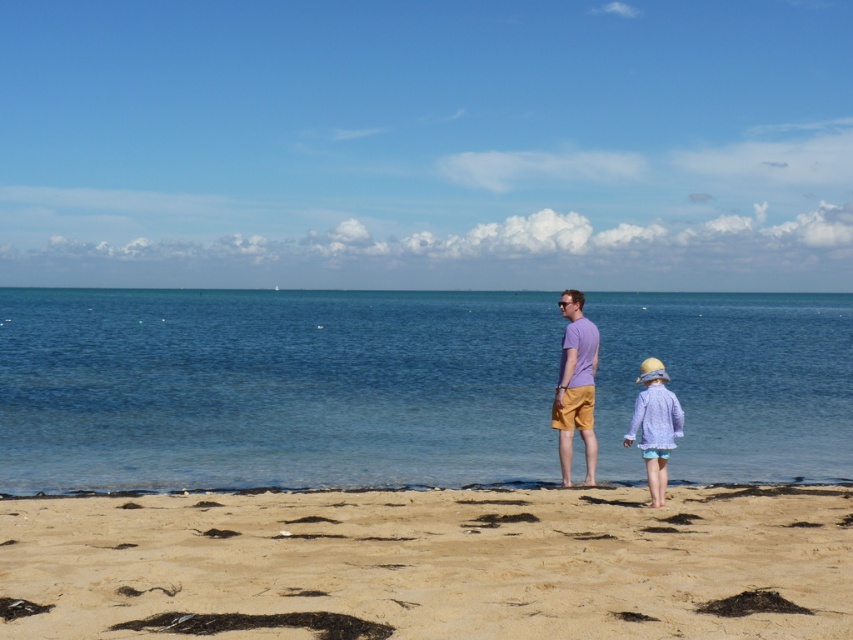
Question: Is light brown sandy beach at lower center above purple cotton shirt at center?

Choices:
 (A) no
 (B) yes

Answer: (A)

Question: Which point is closer to the camera?

Choices:
 (A) purple cotton shirt at center
 (B) light brown sandy beach at lower center
 (C) light purple cotton dress at lower right

Answer: (B)

Question: Observing the image, what is the correct spatial positioning of purple cotton shirt at center in reference to light purple cotton dress at lower right?

Choices:
 (A) below
 (B) above

Answer: (B)

Question: Estimate the real-world distances between objects in this image. Which object is farther from the light purple cotton dress at lower right?

Choices:
 (A) light brown sandy beach at lower center
 (B) clear blue water at center

Answer: (B)

Question: Based on their relative distances, which object is farther from the light brown sandy beach at lower center?

Choices:
 (A) light purple cotton dress at lower right
 (B) purple cotton shirt at center
 (C) clear blue water at center

Answer: (C)

Question: Can you confirm if clear blue water at center is positioned above light brown sandy beach at lower center?

Choices:
 (A) yes
 (B) no

Answer: (A)